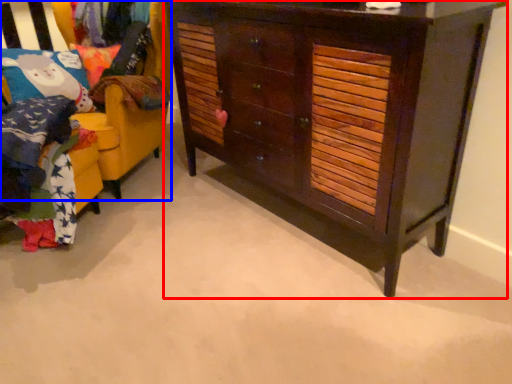
Question: Which object appears closest to the camera in this image, chest of drawers (highlighted by a red box) or furniture (highlighted by a blue box)?

Choices:
 (A) chest of drawers
 (B) furniture

Answer: (A)